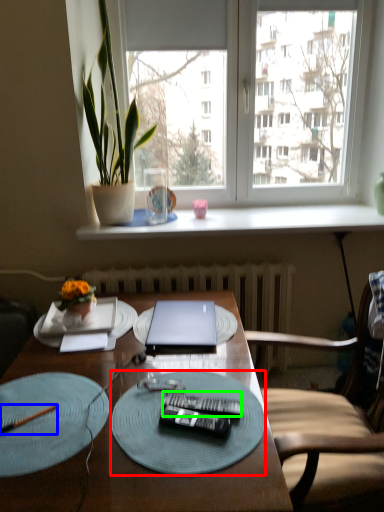
Question: Based on their relative distances, which object is farther from glass plate (highlighted by a red box)? Choose from pen (highlighted by a blue box) and remote control (highlighted by a green box).

Choices:
 (A) pen
 (B) remote control

Answer: (A)